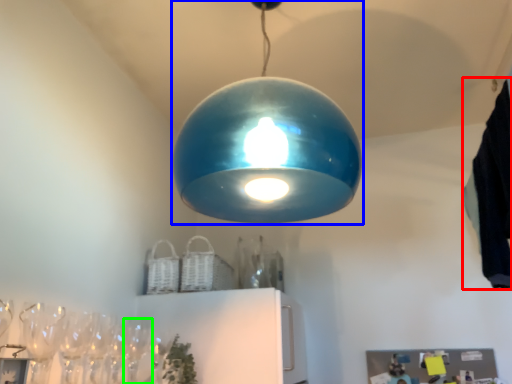
Question: Estimate the real-world distances between objects in this image. Which object is farther from laundry (highlighted by a red box), lamp (highlighted by a blue box) or wine glass (highlighted by a green box)?

Choices:
 (A) lamp
 (B) wine glass

Answer: (B)